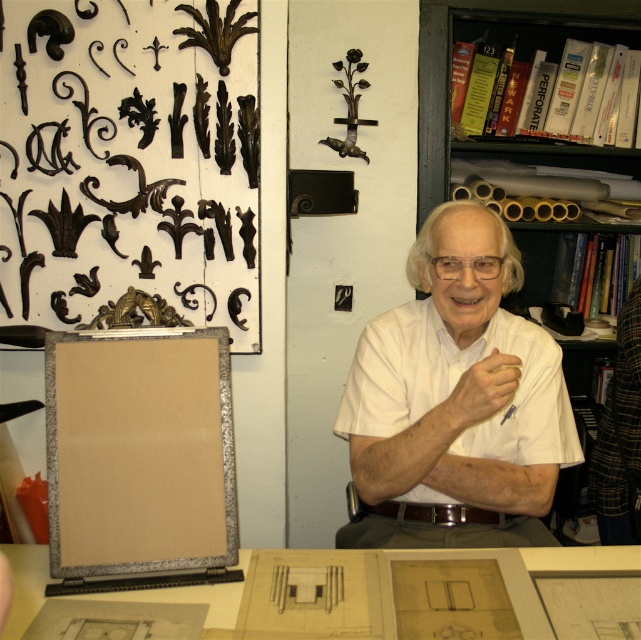
Between white matte shirt at center and green matte bookcase at upper right, which one appears on the left side from the viewer's perspective?

white matte shirt at center

Who is higher up, white matte shirt at center or green matte bookcase at upper right?

green matte bookcase at upper right is above.

Who is more forward, (472, 356) or (537, 17)?

Positioned in front is point (472, 356).

The width and height of the screenshot is (641, 640). I want to click on white matte shirt at center, so click(x=454, y=401).

From the picture: Can you confirm if green matte bookcase at upper right is positioned below matte paper table at lower center?

Actually, green matte bookcase at upper right is above matte paper table at lower center.

Which is behind, point (535, 20) or point (560, 570)?

Point (535, 20)

You are a GUI agent. You are given a task and a screenshot of the screen. Output one action in this format:
    pyautogui.click(x=<x>, y=<y>)
    Task: Click on the green matte bookcase at upper right
    The image size is (641, 640).
    Given the screenshot: What is the action you would take?
    pyautogui.click(x=449, y=67)

Between white matte shirt at center and matte paper table at lower center, which one has less height?

matte paper table at lower center is shorter.

Which is below, white matte shirt at center or matte paper table at lower center?

matte paper table at lower center is below.

Which is in front, point (519, 388) or point (183, 598)?

Point (183, 598) is more forward.

Identify the location of white matte shirt at center. [x=454, y=401].